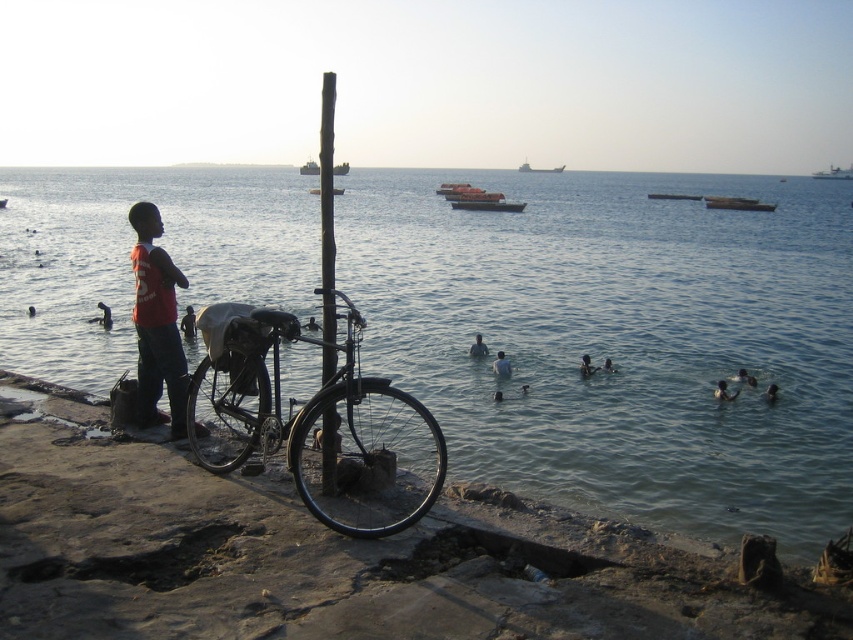
Question: Is red matte shirt at left to the right of metallic gray boat at center from the viewer's perspective?

Choices:
 (A) yes
 (B) no

Answer: (A)

Question: Considering the real-world distances, which object is closest to the metallic gray boat at center?

Choices:
 (A) red matte shirt at left
 (B) shiny black bicycle at center

Answer: (B)

Question: In this image, where is smooth concrete shore at lower left located relative to red matte shirt at left?

Choices:
 (A) above
 (B) below

Answer: (B)

Question: Which point is closer to the camera taking this photo?

Choices:
 (A) (277, 522)
 (B) (490, 195)
 (C) (521, 170)

Answer: (A)

Question: Among these objects, which one is nearest to the camera?

Choices:
 (A) shiny black bicycle at center
 (B) smooth black pole at center
 (C) metallic silver boat at upper right
 (D) wooden boat at center

Answer: (A)

Question: Does red matte shirt at left appear under smooth black pole at center?

Choices:
 (A) no
 (B) yes

Answer: (B)